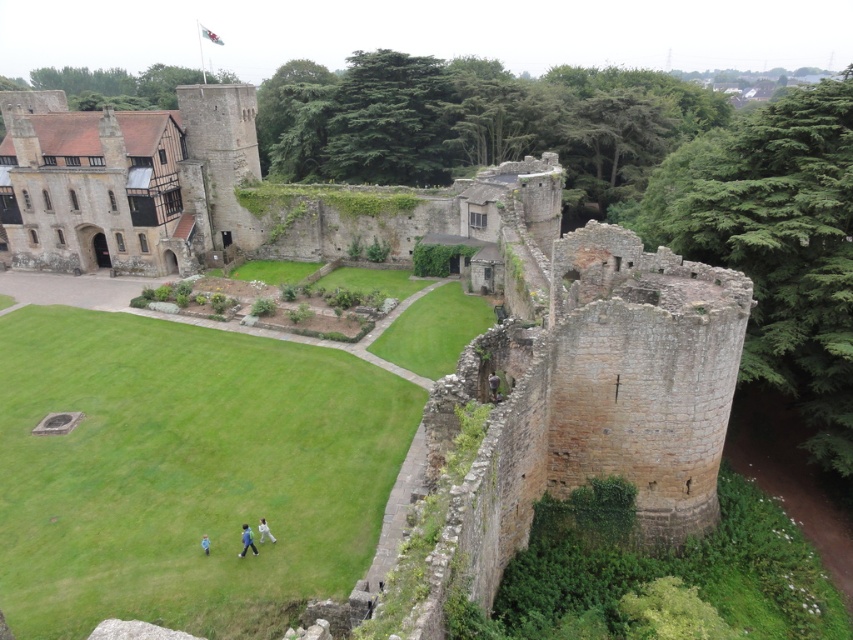
Question: Which point appears closest to the camera in this image?

Choices:
 (A) (68, 256)
 (B) (491, 390)

Answer: (B)

Question: Which point is closer to the camera?

Choices:
 (A) (263, 531)
 (B) (206, 534)
 (C) (496, 396)
 (D) (248, 525)

Answer: (A)

Question: Considering the relative positions of light blue jeans at lower center and brown leather jacket at center in the image provided, where is light blue jeans at lower center located with respect to brown leather jacket at center?

Choices:
 (A) right
 (B) left

Answer: (B)

Question: Does white fabric at center appear under blue fabric person at lower left?

Choices:
 (A) no
 (B) yes

Answer: (A)

Question: Estimate the real-world distances between objects in this image. Which object is closer to the brown leather jacket at center?

Choices:
 (A) brown stone fort at left
 (B) blue fabric person at lower left

Answer: (B)

Question: Is light blue jeans at lower center to the right of brown leather jacket at center from the viewer's perspective?

Choices:
 (A) no
 (B) yes

Answer: (A)